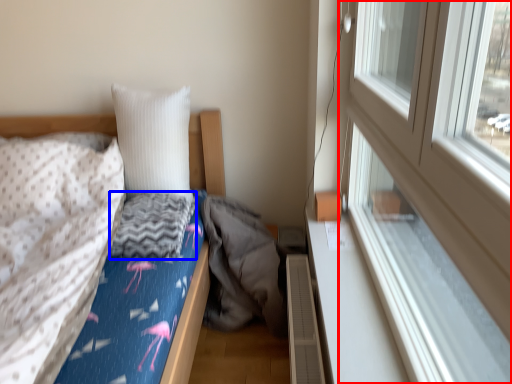
Question: Among these objects, which one is nearest to the camera, window (highlighted by a red box) or material (highlighted by a blue box)?

Choices:
 (A) window
 (B) material

Answer: (A)